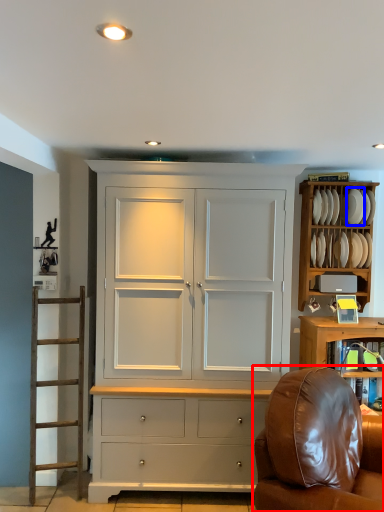
Question: Which object appears closest to the camera in this image, chair (highlighted by a red box) or plate (highlighted by a blue box)?

Choices:
 (A) chair
 (B) plate

Answer: (A)